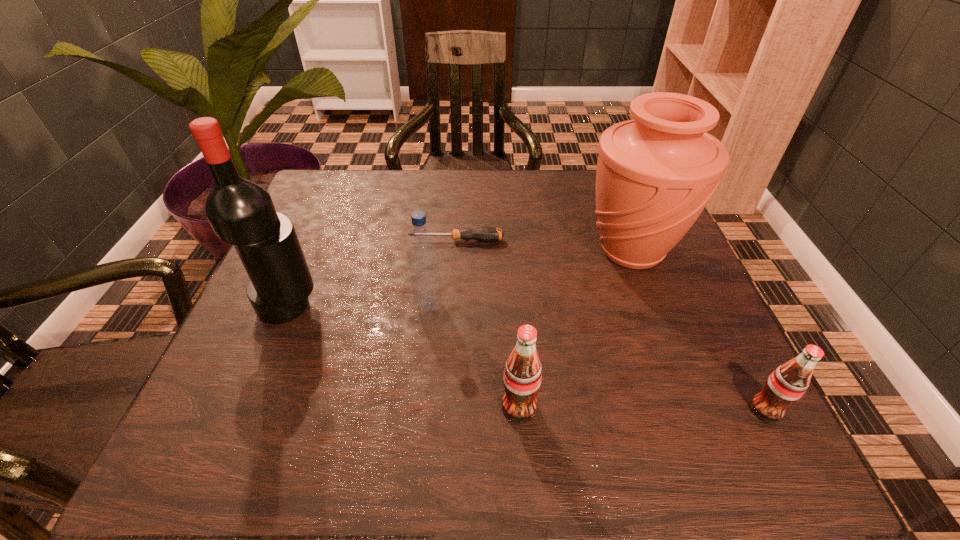
The image size is (960, 540). I want to click on vacant space at the far edge of the desktop, so click(x=495, y=203).

The width and height of the screenshot is (960, 540). In the image, there is a desktop. What are the coordinates of `free space at the near edge` in the screenshot? It's located at (639, 394).

I want to click on vacant space at the left edge, so click(x=345, y=236).

In the image, there is a desktop. At what (x,y) coordinates should I click in order to perform the action: click on free space at the right edge. Please return your answer as a coordinate pair (x, y). This screenshot has height=540, width=960. Looking at the image, I should click on (673, 338).

Identify the location of vacant space at the far left corner. This screenshot has height=540, width=960. (370, 171).

Locate an element on the screen. The width and height of the screenshot is (960, 540). free space that is in between the shortest object and the left soda is located at coordinates (488, 324).

Where is `unoccupied area between the vase and the leftmost object`? The width and height of the screenshot is (960, 540). unoccupied area between the vase and the leftmost object is located at coordinates (460, 279).

Image resolution: width=960 pixels, height=540 pixels. Find the location of `vacant point located between the screwdriver and the vase`. vacant point located between the screwdriver and the vase is located at coordinates (543, 246).

The width and height of the screenshot is (960, 540). I want to click on free space between the screwdriver and the vase, so click(543, 246).

Image resolution: width=960 pixels, height=540 pixels. In order to click on unoccupied position between the screwdriver and the leftmost object in this screenshot , I will do `click(372, 273)`.